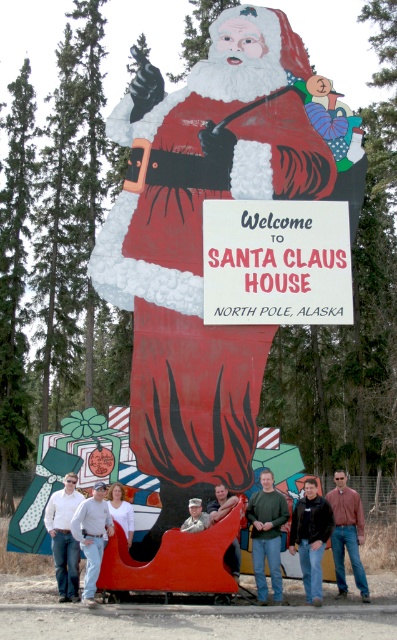
Who is shorter, dark blue jeans at lower center or white shirt at center?

Standing shorter between the two is dark blue jeans at lower center.

Which is below, dark blue jeans at lower center or white shirt at center?

Positioned lower is white shirt at center.

Is point (325, 524) positioned before point (73, 548)?

Yes, point (325, 524) is in front of point (73, 548).

Find the location of a particular element. This screenshot has width=397, height=640. dark blue jeans at lower center is located at coordinates (310, 538).

Is matte red santa claus at center thinner than brown leather jacket at lower right?

No.

Between matte red santa claus at center and brown leather jacket at lower right, which one has more height?

Standing taller between the two is matte red santa claus at center.

Identify the location of matte red santa claus at center. (200, 248).

Is white paper sign at center taller than white cotton shirt at center?

Correct, white paper sign at center is much taller as white cotton shirt at center.

Who is positioned more to the right, white paper sign at center or white cotton shirt at center?

white paper sign at center is more to the right.

Between point (269, 234) and point (90, 580), which one is positioned behind?

Point (269, 234)

Identify the location of white paper sign at center. (275, 260).